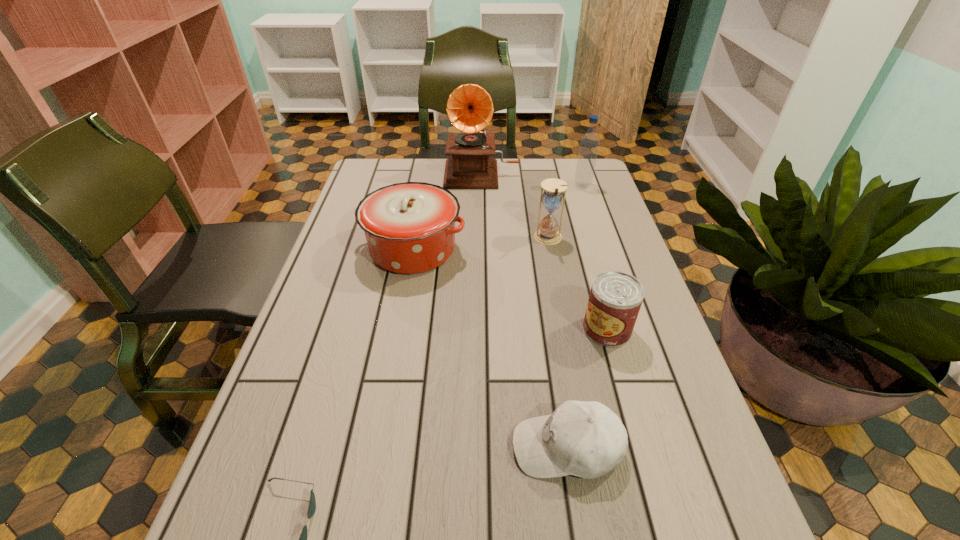
This screenshot has height=540, width=960. Find the location of `unoccupied position between the baseball cap and the casserole`. unoccupied position between the baseball cap and the casserole is located at coordinates [490, 348].

I want to click on object that stands as the fifth closest to the shortest object, so click(469, 108).

Locate which object is the closest to the shortest object. Please provide its 2D coordinates. Your answer should be formatted as a tuple, i.e. [(x, y)], where the tuple contains the x and y coordinates of a point satisfying the conditions above.

[(586, 439)]

This screenshot has height=540, width=960. I want to click on vacant space that satisfies the following two spatial constraints: 1. on the front side of the third shortest object; 2. on the left side of the casserole, so click(398, 329).